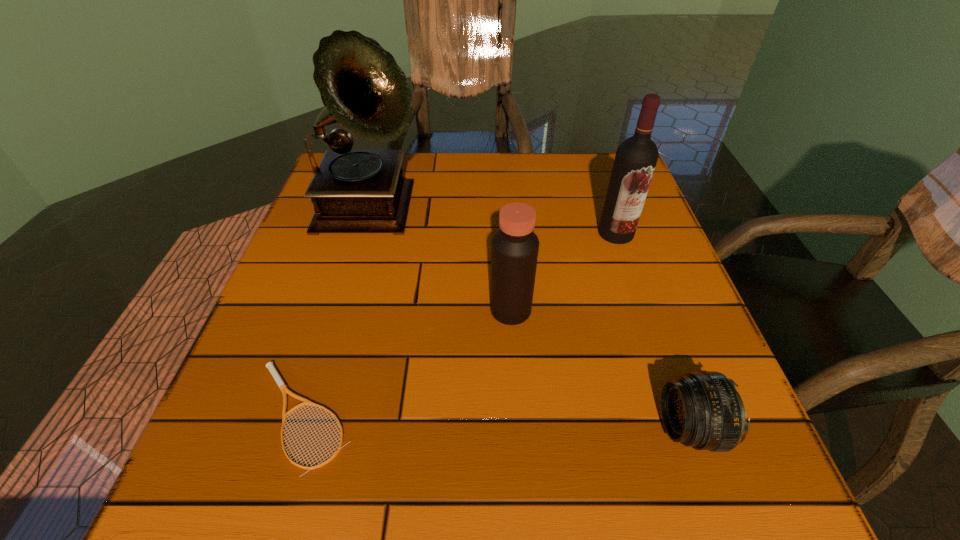
You are a GUI agent. You are given a task and a screenshot of the screen. Output one action in this format:
    pyautogui.click(x=<x>, y=<y>)
    Task: Click on the object that stands as the second closest to the shortest object
    The width and height of the screenshot is (960, 540).
    Given the screenshot: What is the action you would take?
    pyautogui.click(x=363, y=89)

Locate an element on the screen. Image resolution: width=960 pixels, height=540 pixels. vacant space that satisfies the following two spatial constraints: 1. on the horn of the tallest object; 2. on the back side of the third nearest object is located at coordinates (343, 310).

Find the location of a particular element. The width and height of the screenshot is (960, 540). vacant space that satisfies the following two spatial constraints: 1. on the horn of the tallest object; 2. on the front side of the tennis racket is located at coordinates (313, 416).